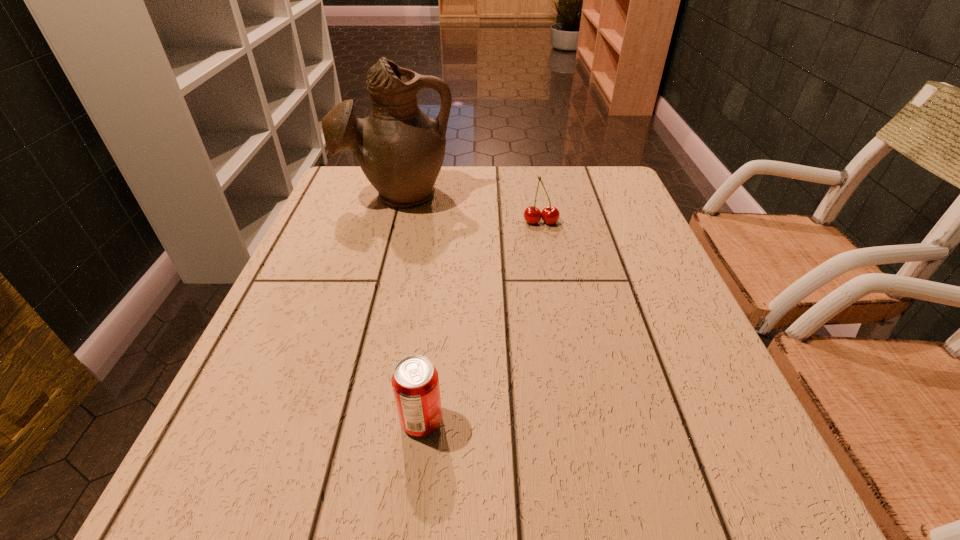
Locate an element on the screen. free space at the near edge of the desktop is located at coordinates (397, 475).

This screenshot has height=540, width=960. Identify the location of vacant region at the left edge of the desktop. (352, 233).

This screenshot has height=540, width=960. I want to click on free space at the right edge of the desktop, so click(x=647, y=225).

Locate an element on the screen. vacant region at the far left corner is located at coordinates (354, 178).

Locate an element on the screen. The image size is (960, 540). vacant region at the near right corner is located at coordinates (719, 472).

Identify the location of vacant area between the cherry and the pitcher. (469, 208).

Find the location of a particular element. This screenshot has height=540, width=960. free spot between the rightmost object and the nearest object is located at coordinates (481, 321).

Where is `blank region between the soda and the cherry`? This screenshot has height=540, width=960. blank region between the soda and the cherry is located at coordinates (481, 321).

The width and height of the screenshot is (960, 540). I want to click on free space that is in between the pitcher and the nearest object, so click(410, 307).

Where is `vacant area that lies between the nearest object and the rightmost object`? This screenshot has width=960, height=540. vacant area that lies between the nearest object and the rightmost object is located at coordinates (481, 321).